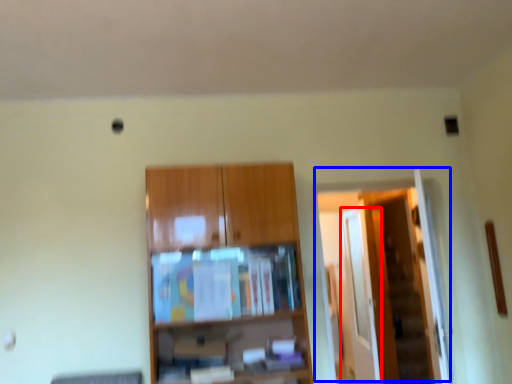
Question: Which object is closer to the camera taking this photo, glass door (highlighted by a red box) or door (highlighted by a blue box)?

Choices:
 (A) glass door
 (B) door

Answer: (B)